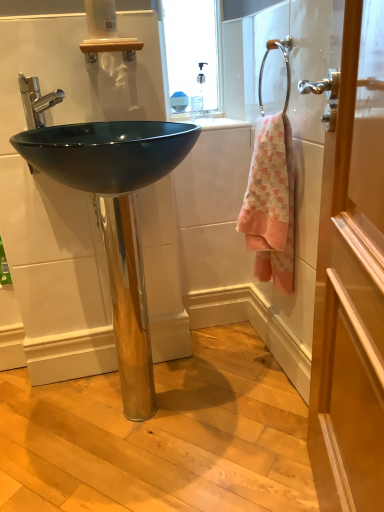
Question: Can you confirm if pink woven towel at right is shorter than chrome metallic towel ring at upper right?

Choices:
 (A) no
 (B) yes

Answer: (A)

Question: Is the depth of pink woven towel at right greater than that of chrome metallic towel ring at upper right?

Choices:
 (A) no
 (B) yes

Answer: (B)

Question: From a real-world perspective, is pink woven towel at right physically above chrome metallic towel ring at upper right?

Choices:
 (A) no
 (B) yes

Answer: (A)

Question: Considering the relative sizes of pink woven towel at right and chrome metallic towel ring at upper right in the image provided, is pink woven towel at right thinner than chrome metallic towel ring at upper right?

Choices:
 (A) yes
 (B) no

Answer: (B)

Question: Does pink woven towel at right have a larger size compared to chrome metallic towel ring at upper right?

Choices:
 (A) yes
 (B) no

Answer: (A)

Question: Is wooden door at right in front of or behind chrome metallic towel ring at upper right in the image?

Choices:
 (A) front
 (B) behind

Answer: (A)

Question: Based on their positions, is wooden door at right located to the left or right of chrome metallic towel ring at upper right?

Choices:
 (A) right
 (B) left

Answer: (A)

Question: From the image's perspective, is wooden door at right positioned above or below chrome metallic towel ring at upper right?

Choices:
 (A) below
 (B) above

Answer: (A)

Question: From a real-world perspective, is wooden door at right above or below chrome metallic towel ring at upper right?

Choices:
 (A) below
 (B) above

Answer: (A)

Question: Considering the positions of polished chrome faucet at upper left and glossy black sink at center in the image, is polished chrome faucet at upper left bigger or smaller than glossy black sink at center?

Choices:
 (A) small
 (B) big

Answer: (A)

Question: From a real-world perspective, relative to glossy black sink at center, is polished chrome faucet at upper left vertically above or below?

Choices:
 (A) above
 (B) below

Answer: (A)

Question: Does point (49, 105) appear closer or farther from the camera than point (125, 155)?

Choices:
 (A) closer
 (B) farther

Answer: (A)

Question: Based on their positions, is polished chrome faucet at upper left located to the left or right of glossy black sink at center?

Choices:
 (A) right
 (B) left

Answer: (B)

Question: Considering the positions of point (23, 82) and point (268, 237), is point (23, 82) closer or farther from the camera than point (268, 237)?

Choices:
 (A) closer
 (B) farther

Answer: (A)

Question: Considering the positions of polished chrome faucet at upper left and pink woven towel at right in the image, is polished chrome faucet at upper left wider or thinner than pink woven towel at right?

Choices:
 (A) thin
 (B) wide

Answer: (A)